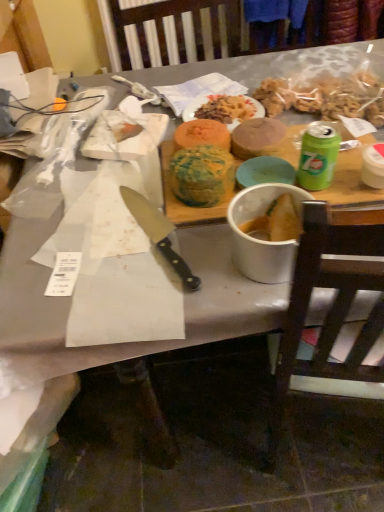
The width and height of the screenshot is (384, 512). Find the location of `empty space that is ontop of matte orange plate at center (from a real-world perspective)`. empty space that is ontop of matte orange plate at center (from a real-world perspective) is located at coordinates (235, 100).